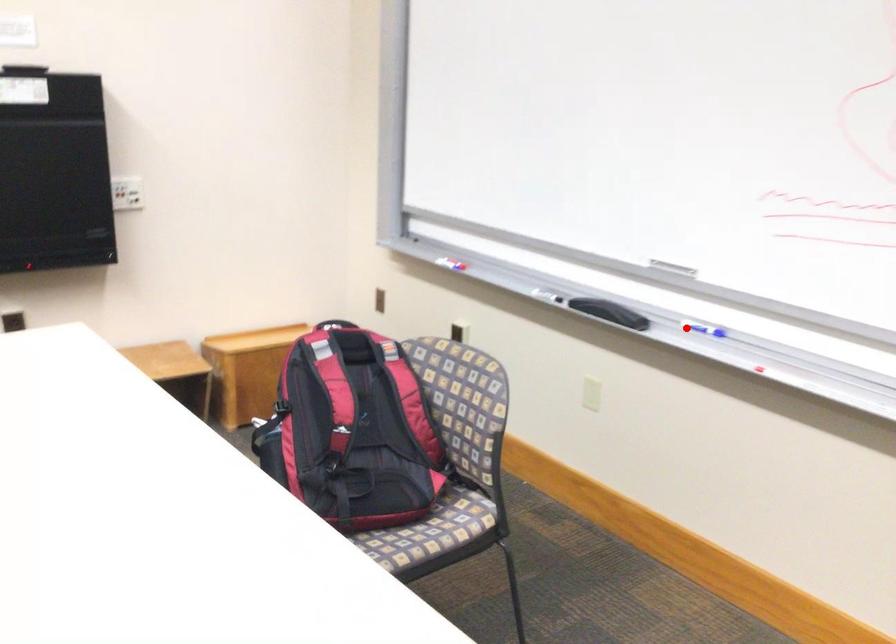
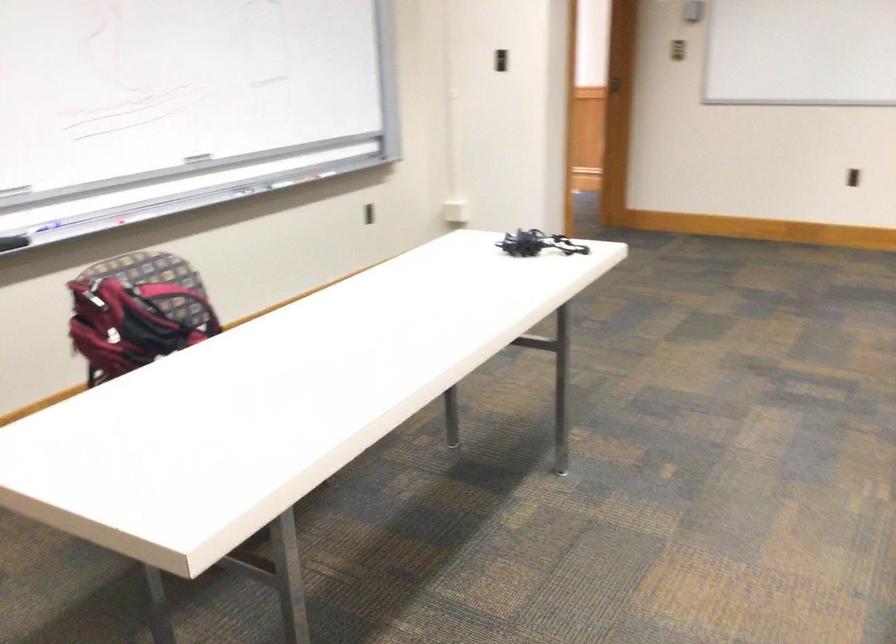
In the second image, find the point that corresponds to the highlighted location in the first image.

(39, 229)